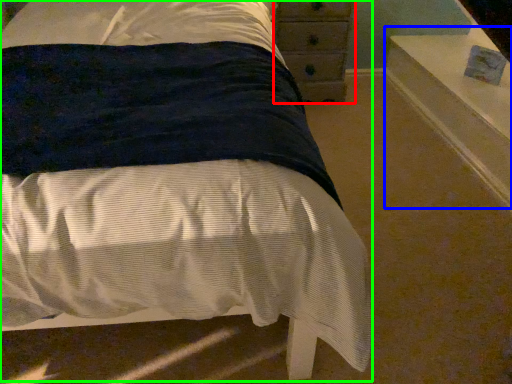
Question: Considering the real-world distances, which object is farthest from chest of drawers (highlighted by a red box)? window sill (highlighted by a blue box) or bed (highlighted by a green box)?

Choices:
 (A) window sill
 (B) bed

Answer: (B)